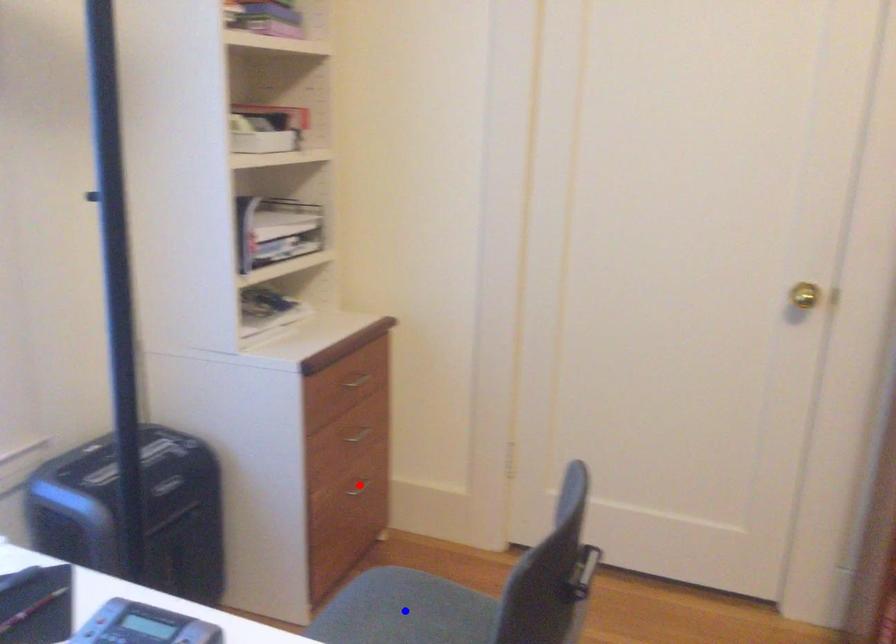
Question: Which of the two points in the image is closer to the camera?

Choices:
 (A) Blue point is closer.
 (B) Red point is closer.

Answer: (A)